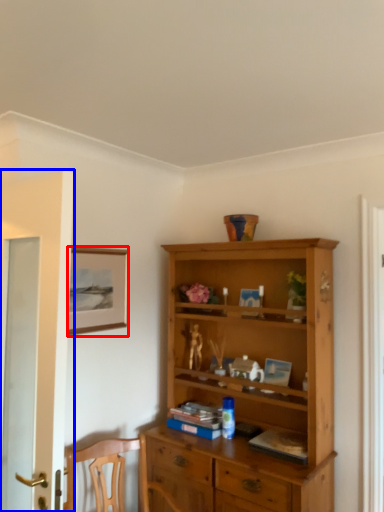
Question: Which point is further to the camera, picture frame (highlighted by a red box) or door (highlighted by a blue box)?

Choices:
 (A) picture frame
 (B) door

Answer: (A)